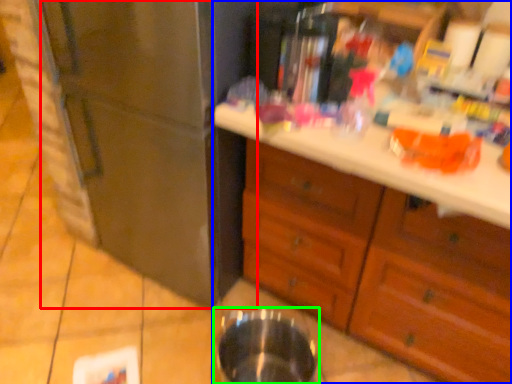
Question: Which object is the closest to the refrigerator (highlighted by a red box)? Choose among these: cabinetry (highlighted by a blue box) or basin (highlighted by a green box).

Choices:
 (A) cabinetry
 (B) basin

Answer: (A)